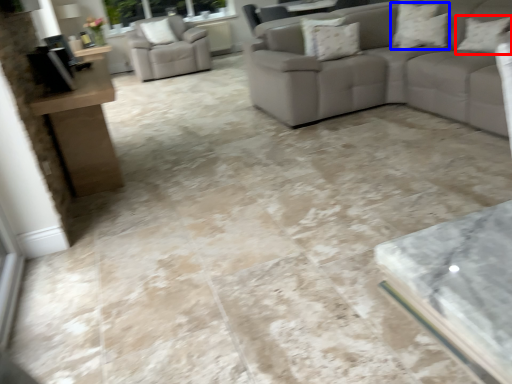
Question: Which point is further to the camera, pillow (highlighted by a red box) or pillow (highlighted by a blue box)?

Choices:
 (A) pillow
 (B) pillow

Answer: (B)